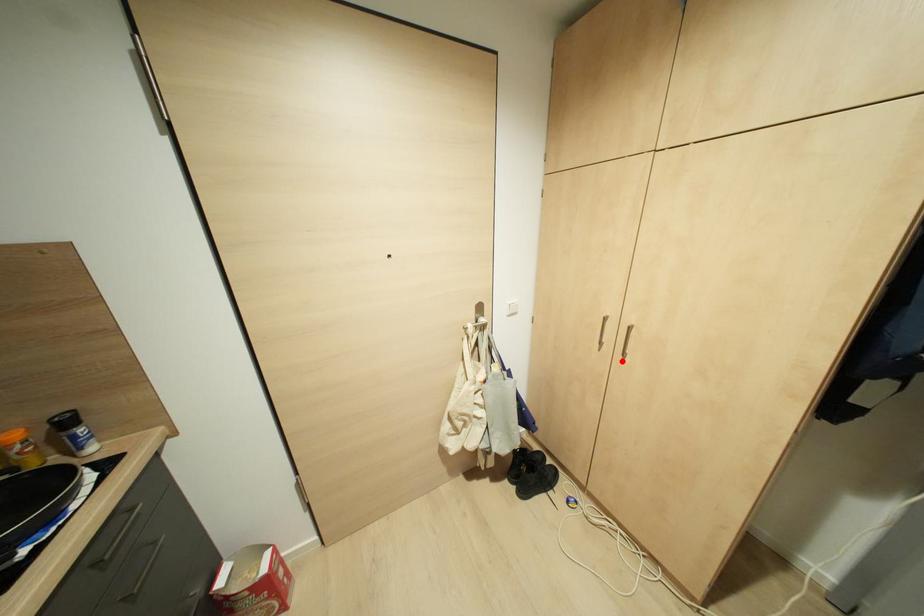
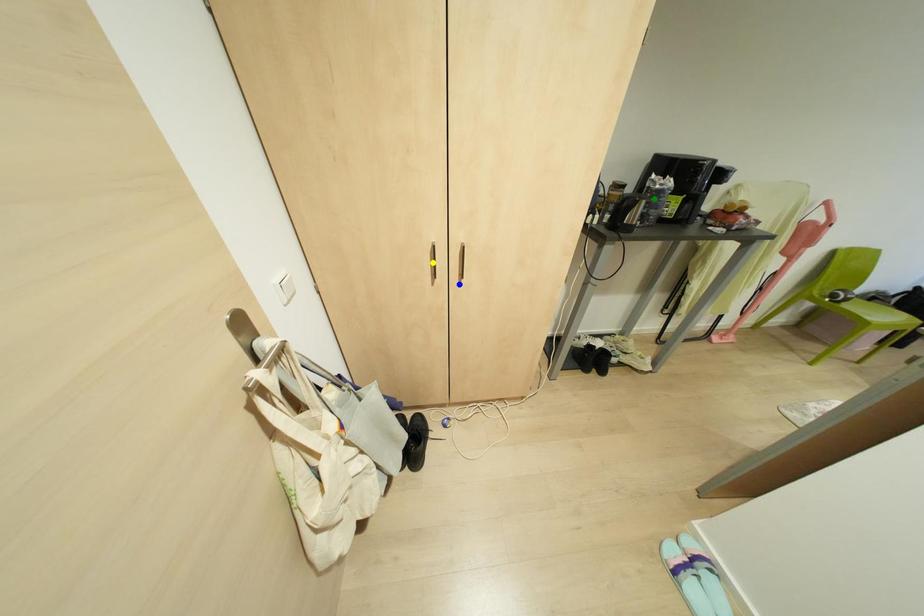
Question: I am providing you with two images of the same scene from different viewpoints. A red point is marked on the first image. You are given multiple points on the second image. Which point in image 2 represents the same 3d spot as the red point in image 1?

Choices:
 (A) yellow point
 (B) blue point
 (C) green point

Answer: (B)